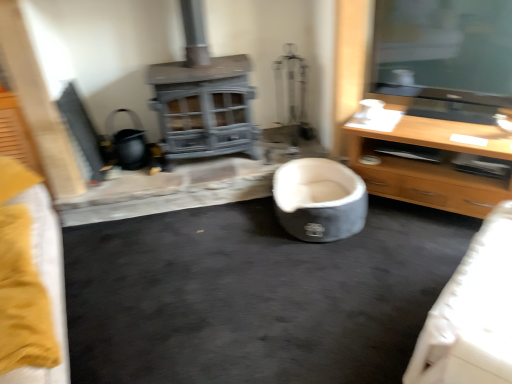
Question: Can you confirm if soft gray fabric bean bag at center is positioned to the right of light wood/finish tv stand at right?

Choices:
 (A) no
 (B) yes

Answer: (A)

Question: From the image's perspective, does soft gray fabric bean bag at center appear higher than light wood/finish tv stand at right?

Choices:
 (A) yes
 (B) no

Answer: (B)

Question: Are soft gray fabric bean bag at center and light wood/finish tv stand at right making contact?

Choices:
 (A) yes
 (B) no

Answer: (B)

Question: From a real-world perspective, is soft gray fabric bean bag at center located beneath light wood/finish tv stand at right?

Choices:
 (A) yes
 (B) no

Answer: (A)

Question: Considering the relative positions of soft gray fabric bean bag at center and light wood/finish tv stand at right in the image provided, is soft gray fabric bean bag at center to the left of light wood/finish tv stand at right from the viewer's perspective?

Choices:
 (A) yes
 (B) no

Answer: (A)

Question: Is soft gray fabric bean bag at center completely or partially outside of light wood/finish tv stand at right?

Choices:
 (A) no
 (B) yes

Answer: (B)

Question: Considering the relative sizes of light wood/finish tv stand at right and soft gray fabric bean bag at center in the image provided, is light wood/finish tv stand at right thinner than soft gray fabric bean bag at center?

Choices:
 (A) yes
 (B) no

Answer: (B)

Question: Can you confirm if light wood/finish tv stand at right is taller than soft gray fabric bean bag at center?

Choices:
 (A) yes
 (B) no

Answer: (A)

Question: From the image's perspective, is light wood/finish tv stand at right above soft gray fabric bean bag at center?

Choices:
 (A) yes
 (B) no

Answer: (A)

Question: Does light wood/finish tv stand at right have a lesser height compared to soft gray fabric bean bag at center?

Choices:
 (A) yes
 (B) no

Answer: (B)

Question: Is light wood/finish tv stand at right facing towards soft gray fabric bean bag at center?

Choices:
 (A) no
 (B) yes

Answer: (B)

Question: Does light wood/finish tv stand at right appear on the left side of soft gray fabric bean bag at center?

Choices:
 (A) no
 (B) yes

Answer: (A)

Question: Is point (444, 188) positioned closer to the camera than point (308, 236)?

Choices:
 (A) farther
 (B) closer

Answer: (B)